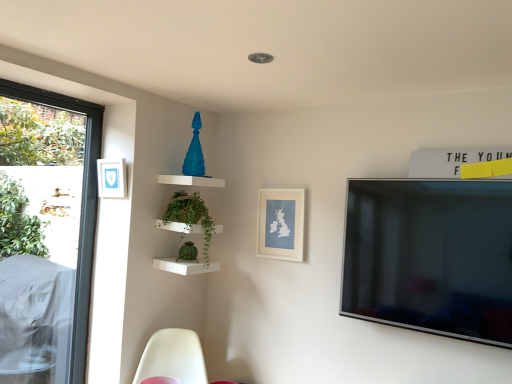
Question: Does white plastic swivel chair at lower left have a lesser height compared to transparent glass window at left?

Choices:
 (A) yes
 (B) no

Answer: (A)

Question: Does white plastic swivel chair at lower left come in front of transparent glass window at left?

Choices:
 (A) no
 (B) yes

Answer: (B)

Question: From a real-world perspective, is white plastic swivel chair at lower left over transparent glass window at left?

Choices:
 (A) yes
 (B) no

Answer: (B)

Question: From the image's perspective, is white plastic swivel chair at lower left located above transparent glass window at left?

Choices:
 (A) no
 (B) yes

Answer: (A)

Question: Is white plastic swivel chair at lower left outside of transparent glass window at left?

Choices:
 (A) yes
 (B) no

Answer: (A)

Question: Is blue matte picture frame at upper left, the second picture frame when ordered from bottom to top, to the left or to the right of white matte picture frame at center, the first picture frame from the right, in the image?

Choices:
 (A) right
 (B) left

Answer: (B)

Question: Considering the positions of point (106, 167) and point (281, 213), is point (106, 167) closer or farther from the camera than point (281, 213)?

Choices:
 (A) closer
 (B) farther

Answer: (A)

Question: From a real-world perspective, relative to white matte picture frame at center, the first picture frame from the right, is blue matte picture frame at upper left, the second picture frame when ordered from bottom to top, vertically above or below?

Choices:
 (A) below
 (B) above

Answer: (B)

Question: From the image's perspective, relative to white matte picture frame at center, which is counted as the second picture frame, starting from the front, is blue matte picture frame at upper left, which appears as the 1th picture frame when viewed from the left, above or below?

Choices:
 (A) above
 (B) below

Answer: (A)

Question: Considering the positions of blue matte picture frame at upper left, which appears as the 1th picture frame when viewed from the left, and green wicker basket at upper center in the image, is blue matte picture frame at upper left, which appears as the 1th picture frame when viewed from the left, bigger or smaller than green wicker basket at upper center?

Choices:
 (A) small
 (B) big

Answer: (A)

Question: Does point (105, 180) appear closer or farther from the camera than point (212, 221)?

Choices:
 (A) closer
 (B) farther

Answer: (A)

Question: Considering their positions, is blue matte picture frame at upper left, the first picture frame viewed from the front, located in front of or behind green wicker basket at upper center?

Choices:
 (A) behind
 (B) front

Answer: (B)

Question: Considering the relative positions of blue matte picture frame at upper left, the second picture frame when ordered from bottom to top, and green wicker basket at upper center in the image provided, is blue matte picture frame at upper left, the second picture frame when ordered from bottom to top, to the left or to the right of green wicker basket at upper center?

Choices:
 (A) left
 (B) right

Answer: (A)

Question: Considering the positions of transparent glass window at left and white matte picture frame at center, the first picture frame from the right, in the image, is transparent glass window at left taller or shorter than white matte picture frame at center, the first picture frame from the right,?

Choices:
 (A) tall
 (B) short

Answer: (A)

Question: Is transparent glass window at left spatially inside white matte picture frame at center, placed as the second picture frame when sorted from left to right, or outside of it?

Choices:
 (A) outside
 (B) inside

Answer: (A)